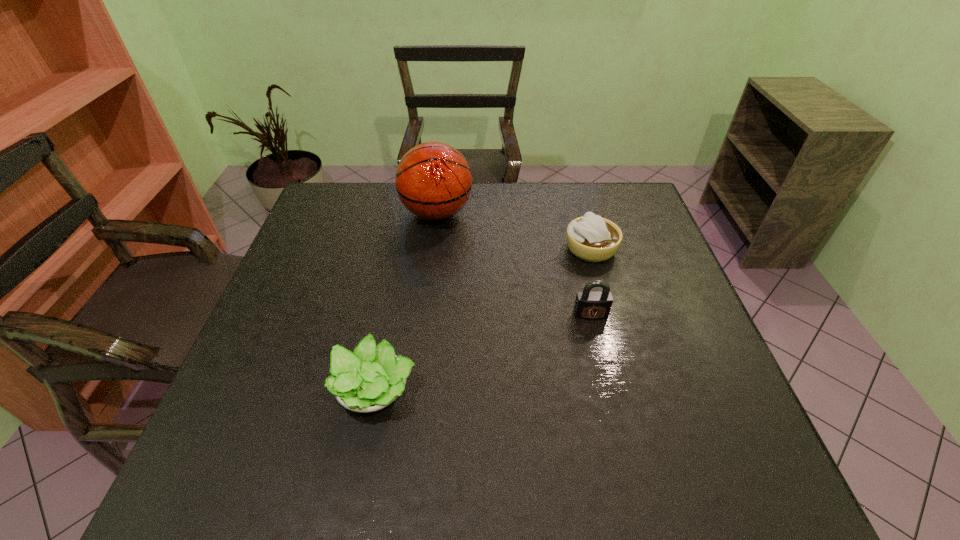
Where is `free spot that satisfies the following two spatial constraints: 1. on the side with spill of the basketball; 2. on the right side of the whipped cream`? This screenshot has height=540, width=960. free spot that satisfies the following two spatial constraints: 1. on the side with spill of the basketball; 2. on the right side of the whipped cream is located at coordinates (433, 249).

I want to click on vacant space that satisfies the following two spatial constraints: 1. on the side with spill of the tallest object; 2. on the right side of the whipped cream, so click(x=433, y=249).

Locate an element on the screen. free space in the image that satisfies the following two spatial constraints: 1. on the side with spill of the tallest object; 2. on the right side of the whipped cream is located at coordinates (433, 249).